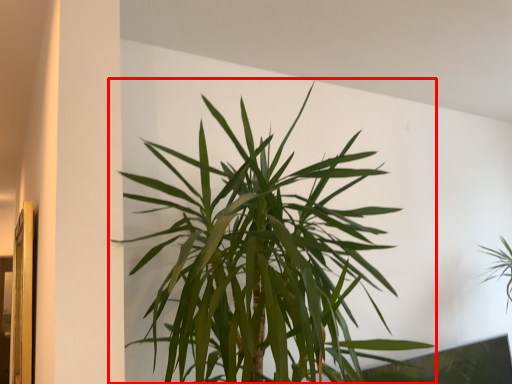
Question: From the image's perspective, considering the relative positions of houseplant (annotated by the red box) and houseplant in the image provided, where is houseplant (annotated by the red box) located with respect to the staircase?

Choices:
 (A) below
 (B) above

Answer: (B)